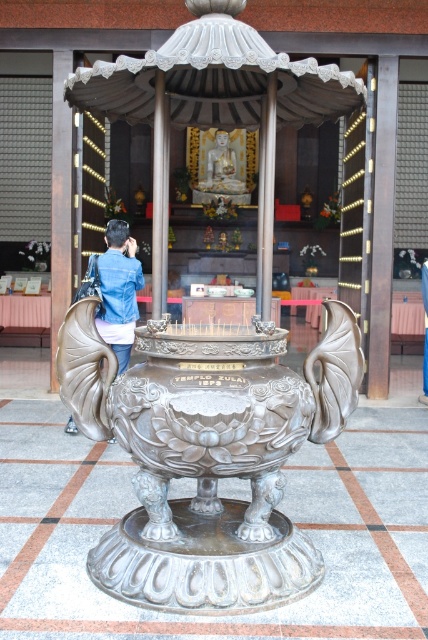
Question: Estimate the real-world distances between objects in this image. Which object is farther from the denim jacket at left?

Choices:
 (A) polished silver sculpture at center
 (B) white marble statue at center

Answer: (B)

Question: Is polished silver sculpture at center to the left of denim jacket at left from the viewer's perspective?

Choices:
 (A) yes
 (B) no

Answer: (B)

Question: Based on their relative distances, which object is farther from the white marble statue at center?

Choices:
 (A) polished silver sculpture at center
 (B) denim jacket at left

Answer: (A)

Question: Which object is closer to the camera taking this photo?

Choices:
 (A) denim jacket at left
 (B) polished silver sculpture at center
 (C) white marble statue at center

Answer: (B)

Question: Considering the relative positions of polished silver sculpture at center and white marble statue at center in the image provided, where is polished silver sculpture at center located with respect to white marble statue at center?

Choices:
 (A) above
 (B) below

Answer: (B)

Question: In this image, where is polished silver sculpture at center located relative to denim jacket at left?

Choices:
 (A) left
 (B) right

Answer: (B)